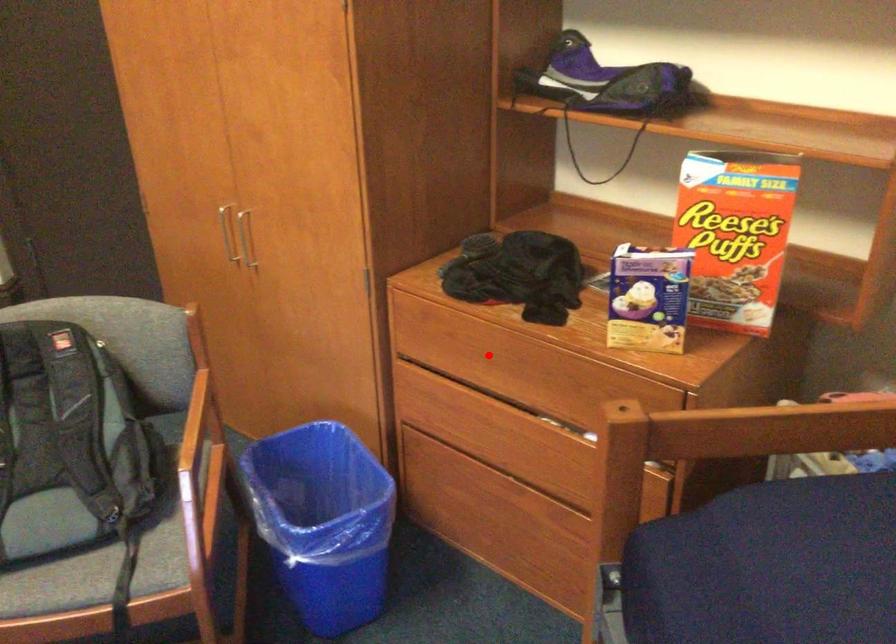
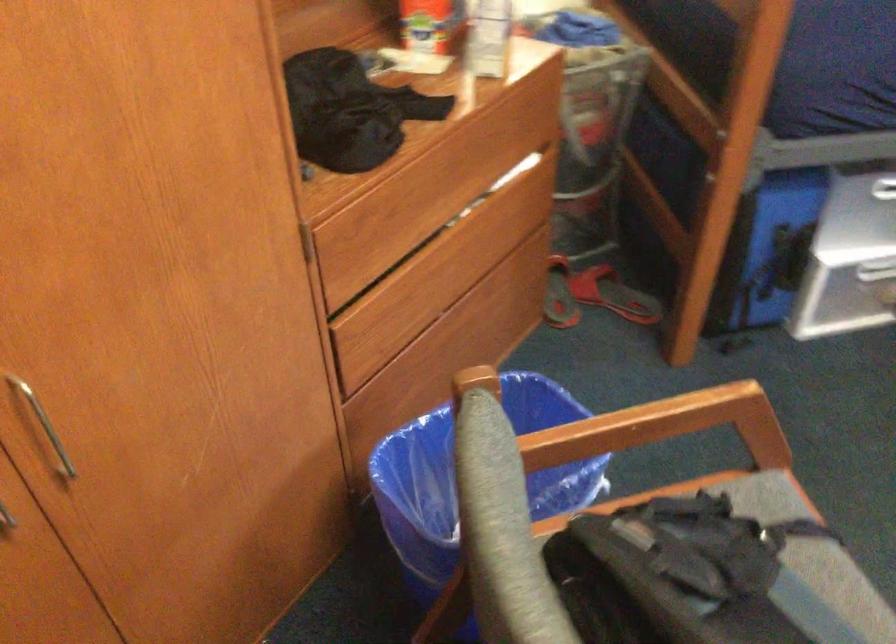
Where in the second image is the point corresponding to the highlighted location from the first image?

(421, 187)